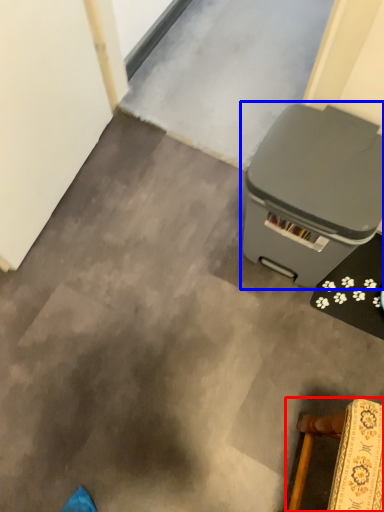
Question: Which of the following is the closest to the observer, furniture (highlighted by a red box) or waste container (highlighted by a blue box)?

Choices:
 (A) furniture
 (B) waste container

Answer: (A)